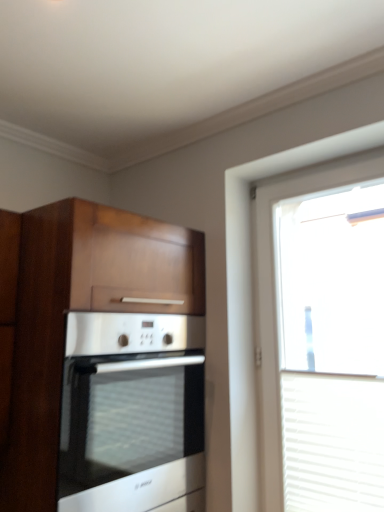
Question: Is satin silver oven at center to the right of wooden cabinet at left from the viewer's perspective?

Choices:
 (A) yes
 (B) no

Answer: (A)

Question: From a real-world perspective, is satin silver oven at center on top of wooden cabinet at left?

Choices:
 (A) yes
 (B) no

Answer: (B)

Question: From the image's perspective, is satin silver oven at center above wooden cabinet at left?

Choices:
 (A) yes
 (B) no

Answer: (B)

Question: Can you confirm if satin silver oven at center is smaller than wooden cabinet at left?

Choices:
 (A) yes
 (B) no

Answer: (A)

Question: From the image's perspective, is satin silver oven at center beneath wooden cabinet at left?

Choices:
 (A) no
 (B) yes

Answer: (B)

Question: From their relative heights in the image, would you say wooden cabinet at left is taller or shorter than satin silver oven at center?

Choices:
 (A) short
 (B) tall

Answer: (B)

Question: In terms of size, does wooden cabinet at left appear bigger or smaller than satin silver oven at center?

Choices:
 (A) big
 (B) small

Answer: (A)

Question: From a real-world perspective, is wooden cabinet at left above or below satin silver oven at center?

Choices:
 (A) above
 (B) below

Answer: (A)

Question: Is point click(x=109, y=356) positioned closer to the camera than point click(x=122, y=478)?

Choices:
 (A) closer
 (B) farther

Answer: (A)

Question: In the image, is transparent glass window at right on the left side or the right side of satin silver oven at center?

Choices:
 (A) right
 (B) left

Answer: (A)

Question: Would you say transparent glass window at right is inside or outside satin silver oven at center?

Choices:
 (A) outside
 (B) inside

Answer: (A)

Question: In the image, is transparent glass window at right positioned in front of or behind satin silver oven at center?

Choices:
 (A) front
 (B) behind

Answer: (B)

Question: From a real-world perspective, relative to satin silver oven at center, is transparent glass window at right vertically above or below?

Choices:
 (A) above
 (B) below

Answer: (A)

Question: From the image's perspective, is satin silver oven at center positioned above or below transparent glass window at right?

Choices:
 (A) below
 (B) above

Answer: (A)

Question: Considering the positions of satin silver oven at center and transparent glass window at right in the image, is satin silver oven at center wider or thinner than transparent glass window at right?

Choices:
 (A) wide
 (B) thin

Answer: (A)